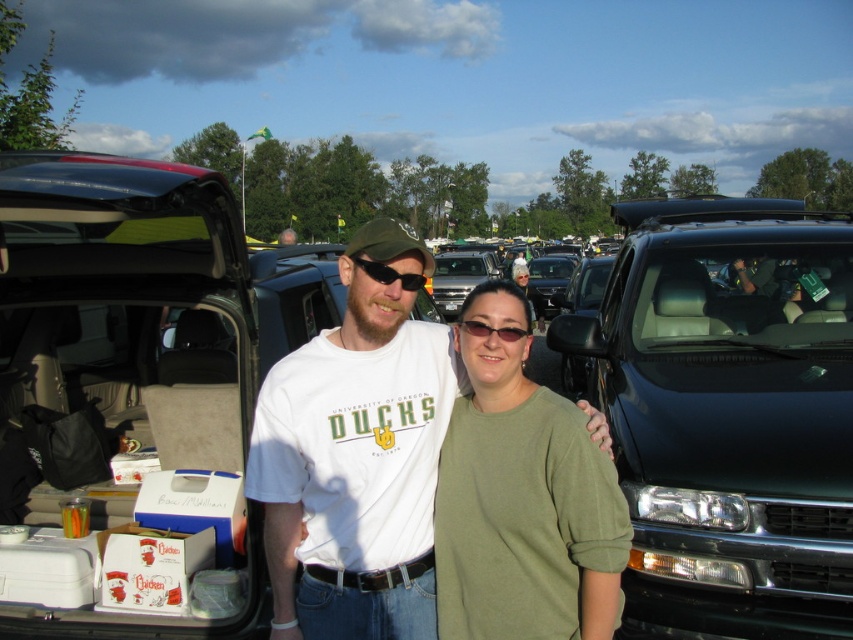
Question: Which point is farther from the camera taking this photo?

Choices:
 (A) (364, 268)
 (B) (819, 289)

Answer: (B)

Question: Which of the following is the closest to the observer?

Choices:
 (A) green matte shirt at center
 (B) black matte sunglasses at center

Answer: (A)

Question: Is white cotton t-shirt at center positioned at the back of matte black sunglasses at center?

Choices:
 (A) no
 (B) yes

Answer: (A)

Question: Estimate the real-world distances between objects in this image. Which object is closer to the shiny black pickup truck at center?

Choices:
 (A) black matte sunglasses at center
 (B) matte black sunglasses at center
 (C) green matte shirt at center
 (D) white cotton t-shirt at center

Answer: (D)

Question: Is black matte sunglasses at center in front of matte black sunglasses at center?

Choices:
 (A) no
 (B) yes

Answer: (B)

Question: Is white cotton t-shirt at center to the right of matte black sunglasses at center from the viewer's perspective?

Choices:
 (A) no
 (B) yes

Answer: (A)